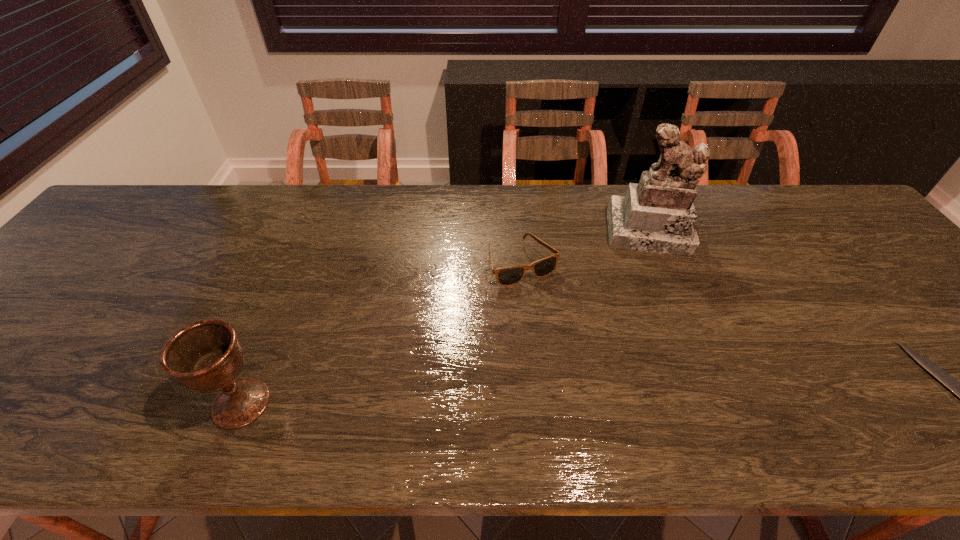
I want to click on vacant space at the far right corner of the desktop, so click(828, 207).

Locate an element on the screen. free space between the leftmost object and the second shortest object is located at coordinates (382, 333).

Image resolution: width=960 pixels, height=540 pixels. Find the location of `unoccupied position between the third shortest object and the tallest object`. unoccupied position between the third shortest object and the tallest object is located at coordinates (446, 318).

Where is `blank region between the second shortest object and the tallest object`? This screenshot has height=540, width=960. blank region between the second shortest object and the tallest object is located at coordinates (587, 247).

Where is `unoccupied area between the figurine and the leftmost object`? unoccupied area between the figurine and the leftmost object is located at coordinates (446, 318).

Where is `free space that is in between the second tallest object and the third object from right to left`? The width and height of the screenshot is (960, 540). free space that is in between the second tallest object and the third object from right to left is located at coordinates (382, 333).

Image resolution: width=960 pixels, height=540 pixels. Identify the location of the third closest object to the third object from left to right. (206, 356).

Locate which object is the closest to the second object from left to right. Please provide its 2D coordinates. Your answer should be formatted as a tuple, i.e. [(x, y)], where the tuple contains the x and y coordinates of a point satisfying the conditions above.

[(657, 215)]